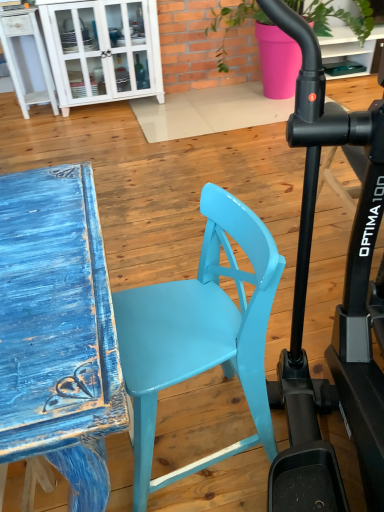
Question: Does white glossy cabinet at upper left have a larger size compared to matte pink pot at upper center?

Choices:
 (A) yes
 (B) no

Answer: (B)

Question: Is white glossy cabinet at upper left at the right side of matte pink pot at upper center?

Choices:
 (A) no
 (B) yes

Answer: (A)

Question: Considering the relative sizes of white glossy cabinet at upper left and matte pink pot at upper center in the image provided, is white glossy cabinet at upper left smaller than matte pink pot at upper center?

Choices:
 (A) no
 (B) yes

Answer: (B)

Question: Considering the relative sizes of white glossy cabinet at upper left and matte pink pot at upper center in the image provided, is white glossy cabinet at upper left thinner than matte pink pot at upper center?

Choices:
 (A) yes
 (B) no

Answer: (A)

Question: Is white glossy cabinet at upper left shorter than matte pink pot at upper center?

Choices:
 (A) yes
 (B) no

Answer: (B)

Question: Is glossy plastic chair at center to the left or to the right of matte pink pot at upper center in the image?

Choices:
 (A) right
 (B) left

Answer: (B)

Question: In terms of width, does glossy plastic chair at center look wider or thinner when compared to matte pink pot at upper center?

Choices:
 (A) wide
 (B) thin

Answer: (B)

Question: Considering the positions of glossy plastic chair at center and matte pink pot at upper center in the image, is glossy plastic chair at center taller or shorter than matte pink pot at upper center?

Choices:
 (A) short
 (B) tall

Answer: (A)

Question: From a real-world perspective, is glossy plastic chair at center above or below matte pink pot at upper center?

Choices:
 (A) above
 (B) below

Answer: (B)

Question: In terms of width, does white glossy cabinet at upper left look wider or thinner when compared to matte pink pot at upper center?

Choices:
 (A) thin
 (B) wide

Answer: (A)

Question: From the image's perspective, is white glossy cabinet at upper left above or below matte pink pot at upper center?

Choices:
 (A) above
 (B) below

Answer: (B)

Question: In the image, is white glossy cabinet at upper left positioned in front of or behind matte pink pot at upper center?

Choices:
 (A) front
 (B) behind

Answer: (B)

Question: Based on their positions, is white glossy cabinet at upper left located to the left or right of matte pink pot at upper center?

Choices:
 (A) left
 (B) right

Answer: (A)

Question: From the image's perspective, is matte pink pot at upper center above or below white glossy cabinet at upper left?

Choices:
 (A) above
 (B) below

Answer: (A)

Question: Is point (218, 57) positioned closer to the camera than point (105, 89)?

Choices:
 (A) closer
 (B) farther

Answer: (B)